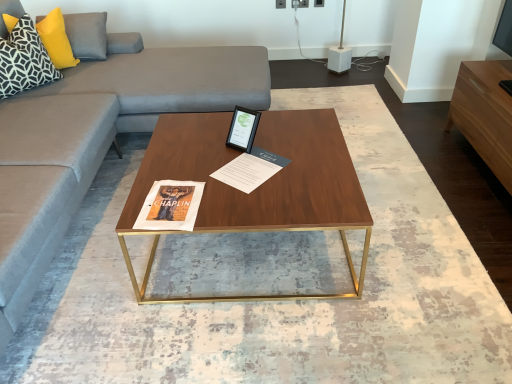
Identify the location of unoccupied region to the right of matte black tablet at center. (278, 140).